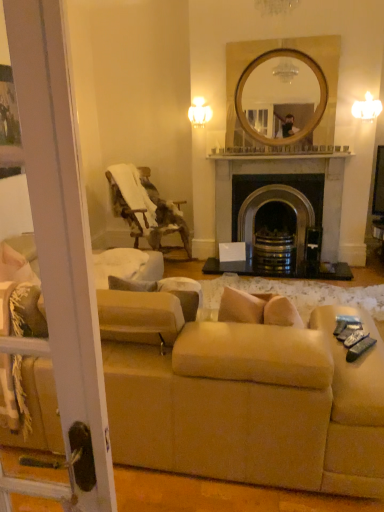
Question: Is wooden textured chair at left outside of black stone fireplace at center?

Choices:
 (A) no
 (B) yes

Answer: (B)

Question: Is wooden textured chair at left at the left side of black stone fireplace at center?

Choices:
 (A) no
 (B) yes

Answer: (B)

Question: Does wooden textured chair at left have a greater width compared to black stone fireplace at center?

Choices:
 (A) yes
 (B) no

Answer: (A)

Question: Does wooden textured chair at left contain black stone fireplace at center?

Choices:
 (A) no
 (B) yes

Answer: (A)

Question: From the image's perspective, is wooden textured chair at left on top of black stone fireplace at center?

Choices:
 (A) no
 (B) yes

Answer: (A)

Question: Is beige fabric couch at lower center in front of or behind black stone fireplace at center in the image?

Choices:
 (A) behind
 (B) front

Answer: (B)

Question: From a real-world perspective, is beige fabric couch at lower center positioned above or below black stone fireplace at center?

Choices:
 (A) above
 (B) below

Answer: (B)

Question: Based on their sizes in the image, would you say beige fabric couch at lower center is bigger or smaller than black stone fireplace at center?

Choices:
 (A) small
 (B) big

Answer: (B)

Question: Looking at their shapes, would you say beige fabric couch at lower center is wider or thinner than black stone fireplace at center?

Choices:
 (A) thin
 (B) wide

Answer: (B)

Question: Considering the positions of black stone fireplace at center and wooden textured chair at left in the image, is black stone fireplace at center taller or shorter than wooden textured chair at left?

Choices:
 (A) short
 (B) tall

Answer: (B)

Question: Is black stone fireplace at center wider or thinner than wooden textured chair at left?

Choices:
 (A) thin
 (B) wide

Answer: (A)

Question: From a real-world perspective, relative to wooden textured chair at left, is black stone fireplace at center vertically above or below?

Choices:
 (A) below
 (B) above

Answer: (B)

Question: Is black stone fireplace at center bigger or smaller than wooden textured chair at left?

Choices:
 (A) small
 (B) big

Answer: (A)

Question: Is beige fabric couch at lower center inside or outside of wooden textured chair at left?

Choices:
 (A) inside
 (B) outside

Answer: (B)

Question: From a real-world perspective, is beige fabric couch at lower center above or below wooden textured chair at left?

Choices:
 (A) above
 (B) below

Answer: (B)